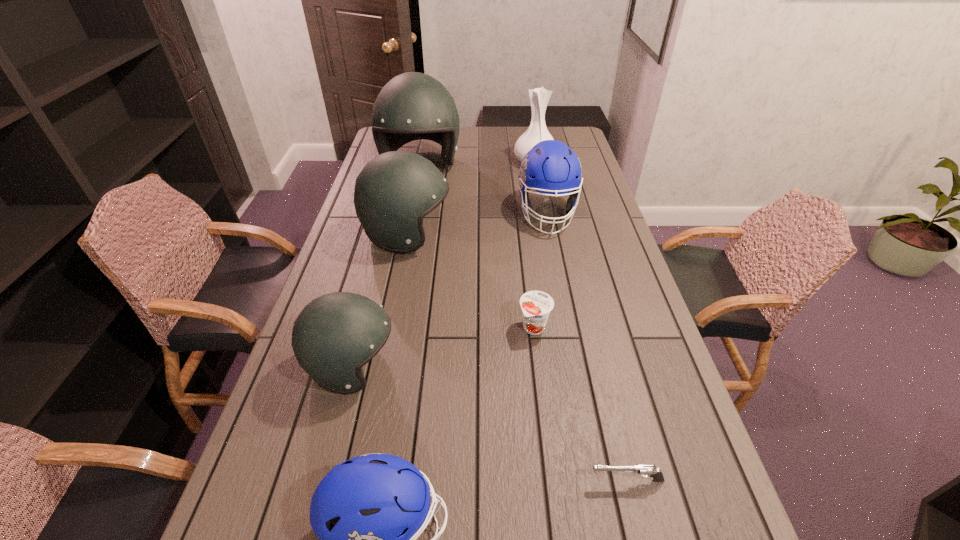
Find the location of `object that is at the far edge`. object that is at the far edge is located at coordinates (412, 106).

The width and height of the screenshot is (960, 540). I want to click on vase at the right edge, so click(x=539, y=97).

I want to click on football helmet at the right edge, so click(550, 167).

Locate an element on the screen. pistol located in the right edge section of the desktop is located at coordinates (645, 470).

This screenshot has height=540, width=960. Identify the location of object that is at the far left corner. (412, 106).

Locate an element on the screen. The height and width of the screenshot is (540, 960). vacant area at the far edge is located at coordinates (462, 141).

Identify the location of free space at the right edge. This screenshot has height=540, width=960. (620, 272).

In order to click on blank region between the farthest football helmet and the rightmost football helmet in this screenshot , I will do `click(484, 190)`.

I want to click on free space between the farther blue football helmet and the nearest green football helmet, so click(449, 290).

This screenshot has height=540, width=960. I want to click on empty space between the silver pistol and the bigger blue football helmet, so click(587, 347).